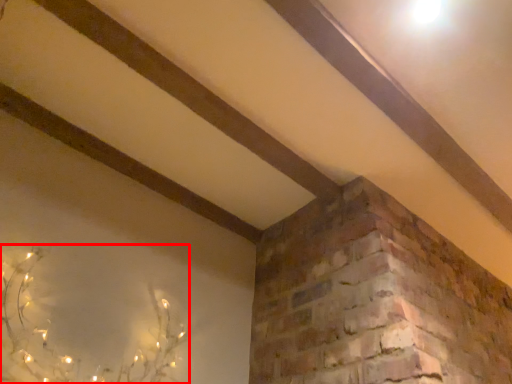
Question: From the image's perspective, considering the relative positions of plant (annotated by the red box) and plank in the image provided, where is plant (annotated by the red box) located with respect to the staircase?

Choices:
 (A) below
 (B) above

Answer: (A)